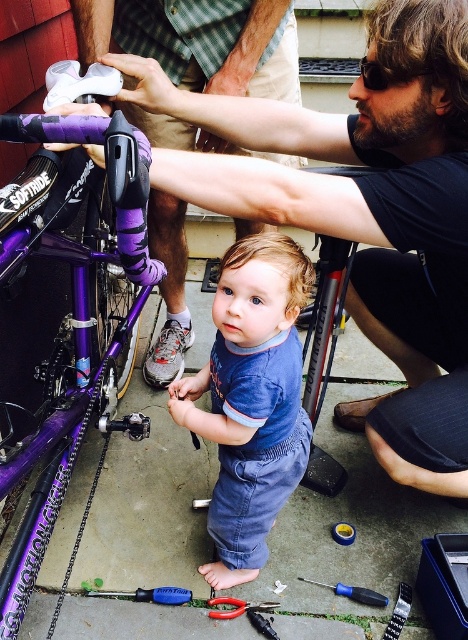
Question: Which of the following is the closest to the observer?

Choices:
 (A) (322, 586)
 (B) (404, 456)
 (C) (90, 324)
 (D) (256, 515)

Answer: (B)

Question: Which point is farther to the camera?

Choices:
 (A) (346, 592)
 (B) (39, 433)
 (C) (139, 588)
 (D) (242, 410)

Answer: (C)

Question: Can you confirm if purple matte bicycle at left is bigger than blue plastic screwdriver at center?

Choices:
 (A) yes
 (B) no

Answer: (A)

Question: In this image, where is blue plastic screwdriver at lower center located relative to blue plastic screwdriver at center?

Choices:
 (A) left
 (B) right

Answer: (A)

Question: Does blue denim overalls at center appear over metallic silver pliers at lower center?

Choices:
 (A) no
 (B) yes

Answer: (B)

Question: Which point appears farthest from the camera in this image?

Choices:
 (A) (249, 604)
 (B) (155, 593)

Answer: (B)